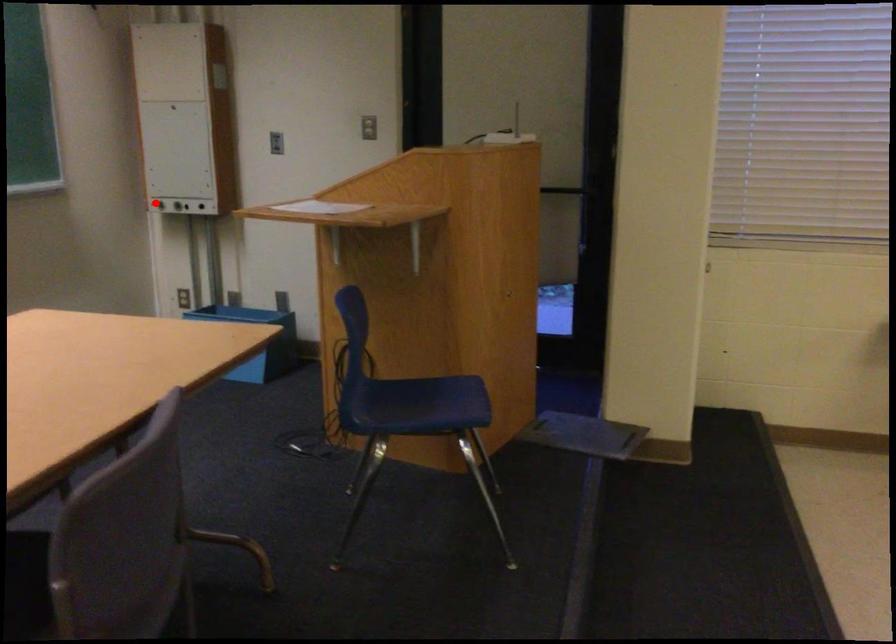
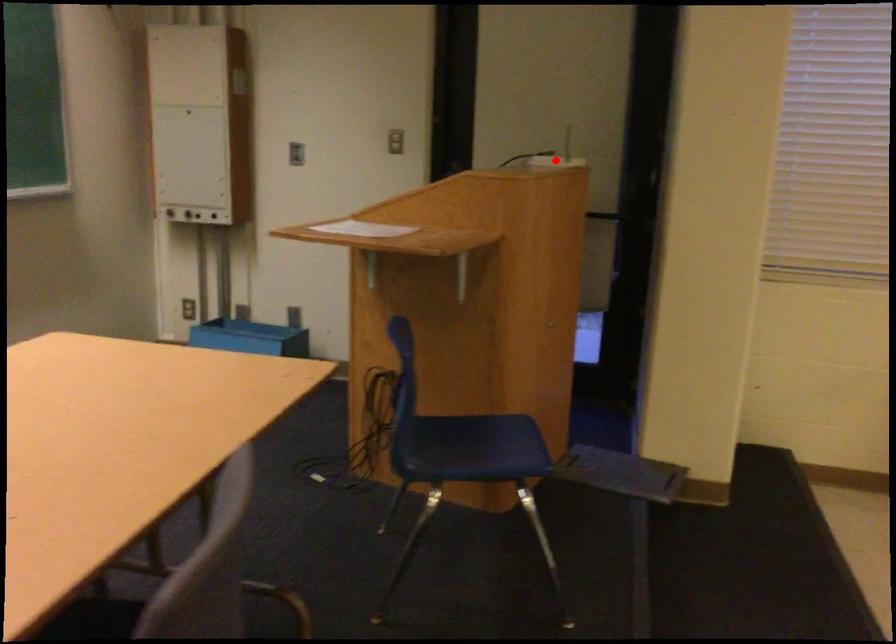
I am providing you with two images of the same scene from different viewpoints. A red point is marked on the first image and another point is marked on the second image. Do the highlighted points in image1 and image2 indicate the same real-world spot?

No